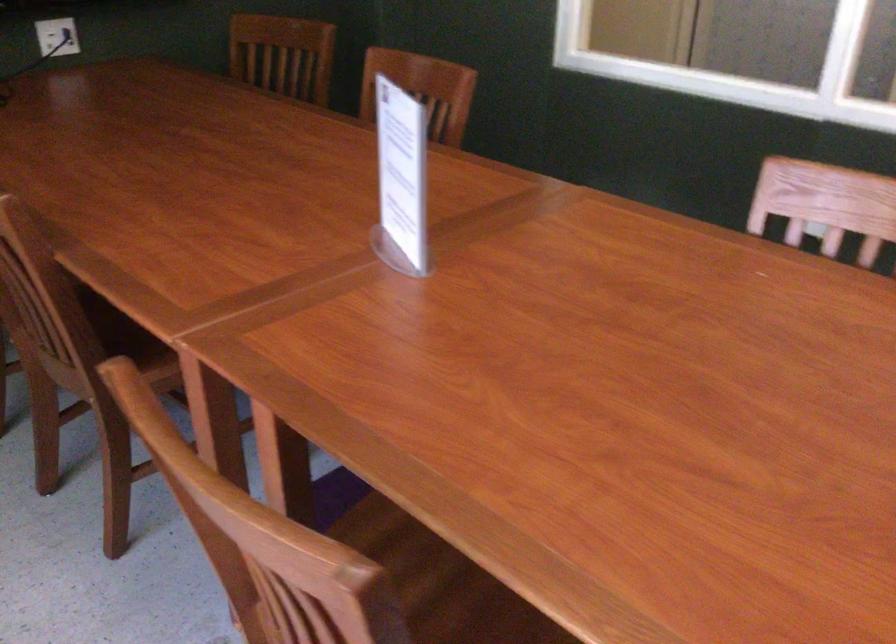
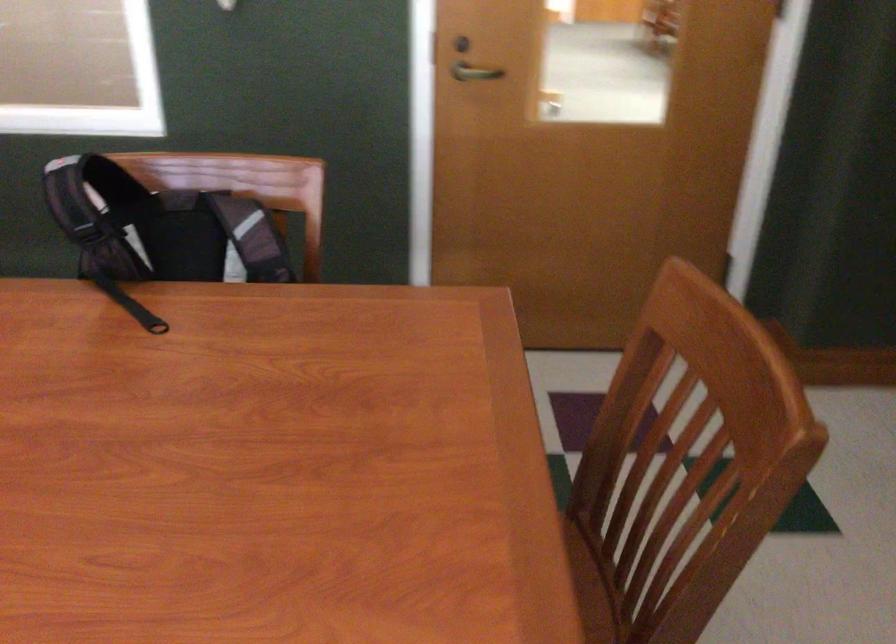
Question: The first image is from the beginning of the video and the second image is from the end. How did the camera likely rotate when shooting the video?

Choices:
 (A) Left
 (B) Right
 (C) Up
 (D) Down

Answer: (B)